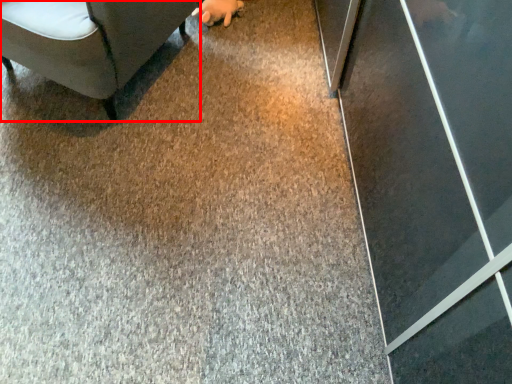
Question: Observing the image, what is the correct spatial positioning of furniture (annotated by the red box) in reference to hand?

Choices:
 (A) left
 (B) right

Answer: (A)